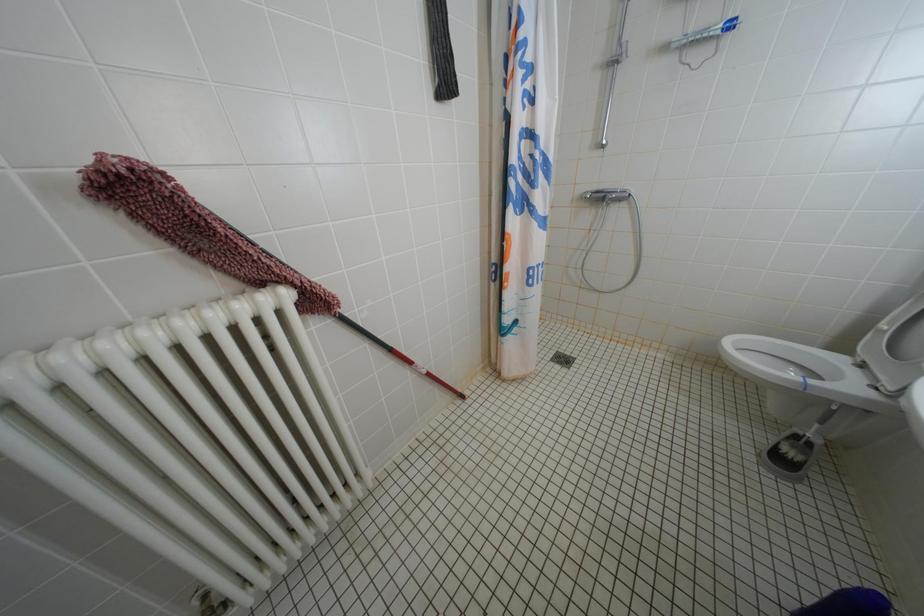
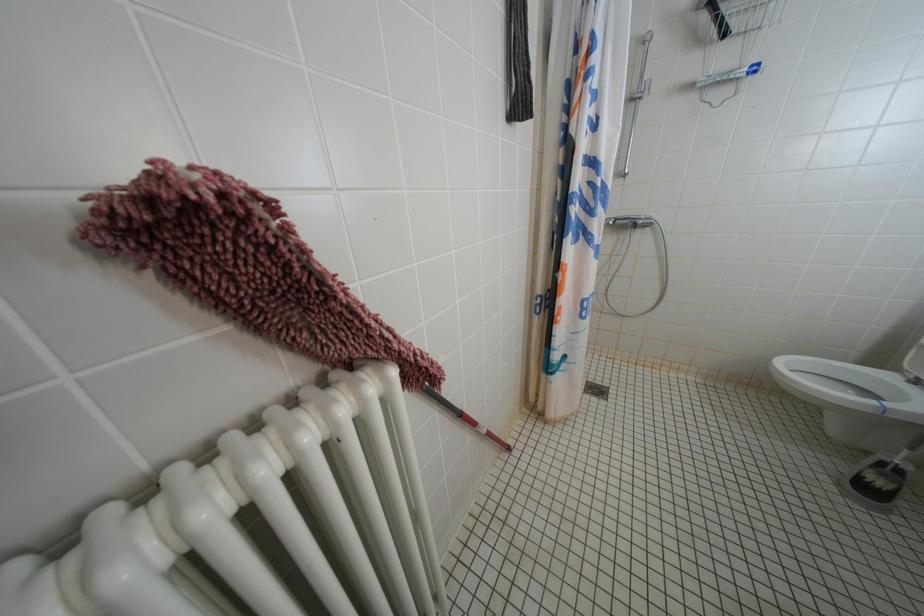
In a continuous first-person perspective shot, in which direction is the camera moving?

The cameraman moved toward left, forward.